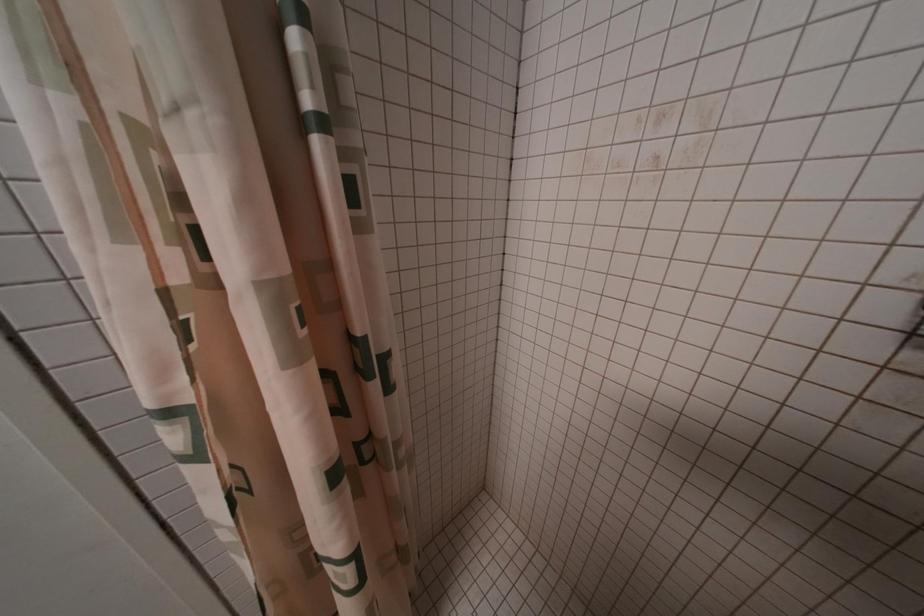
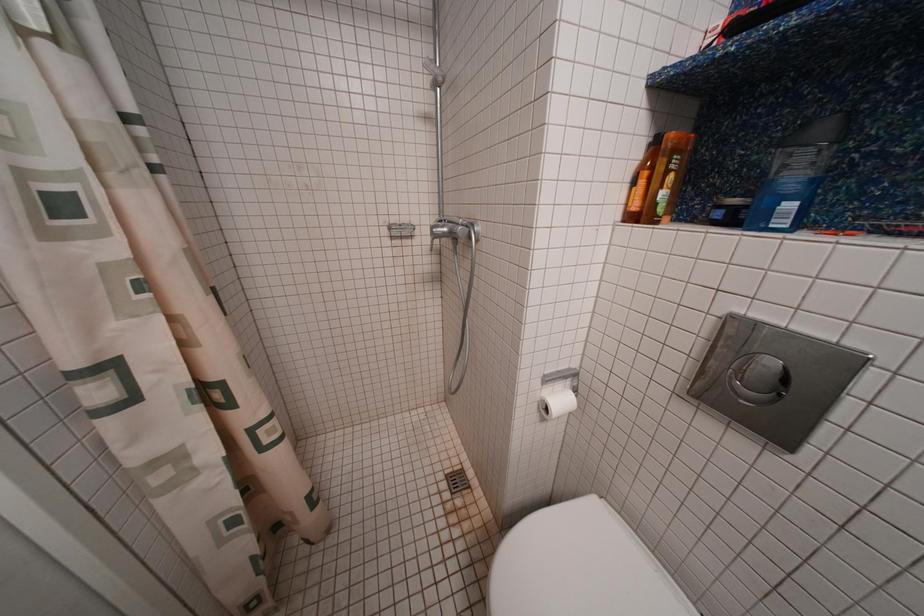
Question: The camera is either moving clockwise (left) or counter-clockwise (right) around the object. The first image is from the beginning of the video and the second image is from the end. Is the camera moving left or right when shooting the video?

Choices:
 (A) Left
 (B) Right

Answer: (A)